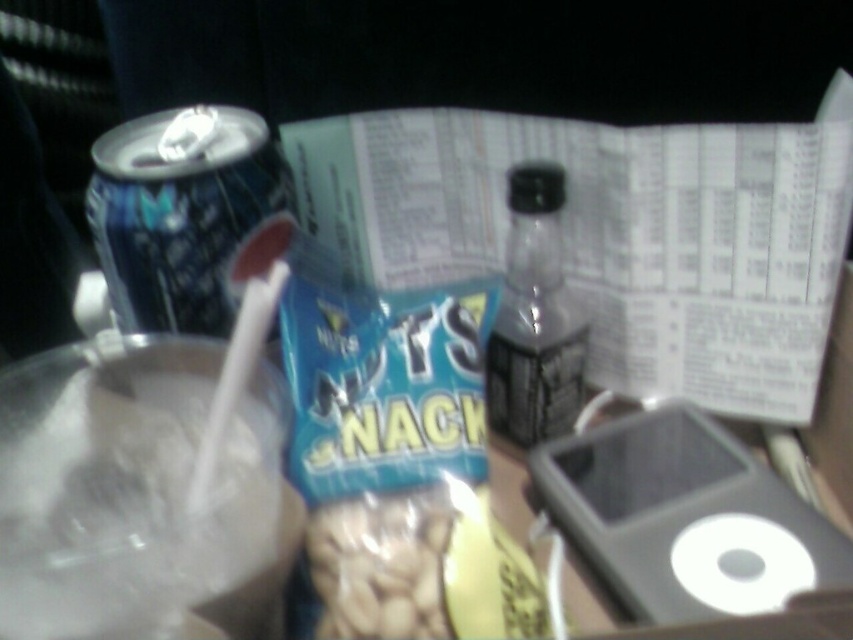
Question: Considering the relative positions of black plastic ipod at center and blue metallic can at left in the image provided, where is black plastic ipod at center located with respect to blue metallic can at left?

Choices:
 (A) left
 (B) right

Answer: (B)

Question: Can you confirm if blue metallic can at left is smaller than clear glass bottle at center?

Choices:
 (A) no
 (B) yes

Answer: (A)

Question: Does blue metallic can at left have a lesser width compared to clear glass bottle at center?

Choices:
 (A) no
 (B) yes

Answer: (A)

Question: Estimate the real-world distances between objects in this image. Which object is closer to the translucent plastic peanuts at center?

Choices:
 (A) black plastic ipod at center
 (B) blue metallic can at left
 (C) clear glass bottle at center

Answer: (A)

Question: Which object appears farthest from the camera in this image?

Choices:
 (A) translucent plastic peanuts at center
 (B) black plastic ipod at center
 (C) blue metallic can at left
 (D) clear glass bottle at center

Answer: (D)

Question: Which object is positioned closest to the translucent plastic peanuts at center?

Choices:
 (A) blue metallic can at left
 (B) black plastic ipod at center
 (C) clear glass bottle at center

Answer: (B)